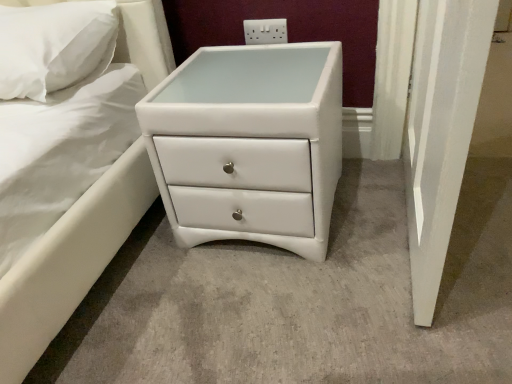
Question: From the image's perspective, would you say white soft pillow at upper left is shown under white plastic electric outlet at upper center?

Choices:
 (A) no
 (B) yes

Answer: (B)

Question: From the image's perspective, is white soft pillow at upper left over white plastic electric outlet at upper center?

Choices:
 (A) no
 (B) yes

Answer: (A)

Question: Is white soft pillow at upper left bigger than white plastic electric outlet at upper center?

Choices:
 (A) yes
 (B) no

Answer: (A)

Question: Is there a large distance between white soft pillow at upper left and white plastic electric outlet at upper center?

Choices:
 (A) yes
 (B) no

Answer: (B)

Question: Considering the relative positions of white soft pillow at upper left and white plastic electric outlet at upper center in the image provided, is white soft pillow at upper left to the left of white plastic electric outlet at upper center from the viewer's perspective?

Choices:
 (A) no
 (B) yes

Answer: (B)

Question: Considering the positions of point (272, 43) and point (240, 190), is point (272, 43) closer or farther from the camera than point (240, 190)?

Choices:
 (A) farther
 (B) closer

Answer: (A)

Question: Considering the relative positions of white plastic electric outlet at upper center and white leather chest of drawers at center in the image provided, is white plastic electric outlet at upper center to the left or to the right of white leather chest of drawers at center?

Choices:
 (A) left
 (B) right

Answer: (B)

Question: From a real-world perspective, is white plastic electric outlet at upper center positioned above or below white leather chest of drawers at center?

Choices:
 (A) above
 (B) below

Answer: (A)

Question: Looking at their shapes, would you say white plastic electric outlet at upper center is wider or thinner than white leather chest of drawers at center?

Choices:
 (A) thin
 (B) wide

Answer: (A)

Question: In terms of size, does white plastic electric outlet at upper center appear bigger or smaller than white soft pillow at upper left?

Choices:
 (A) big
 (B) small

Answer: (B)

Question: Does point (244, 31) appear closer or farther from the camera than point (106, 33)?

Choices:
 (A) farther
 (B) closer

Answer: (A)

Question: Considering the positions of white plastic electric outlet at upper center and white soft pillow at upper left in the image, is white plastic electric outlet at upper center taller or shorter than white soft pillow at upper left?

Choices:
 (A) tall
 (B) short

Answer: (B)

Question: Looking at their shapes, would you say white plastic electric outlet at upper center is wider or thinner than white soft pillow at upper left?

Choices:
 (A) thin
 (B) wide

Answer: (A)

Question: From a real-world perspective, relative to white plastic electric outlet at upper center, is white leather chest of drawers at center vertically above or below?

Choices:
 (A) below
 (B) above

Answer: (A)

Question: From the image's perspective, is white leather chest of drawers at center located above or below white plastic electric outlet at upper center?

Choices:
 (A) below
 (B) above

Answer: (A)